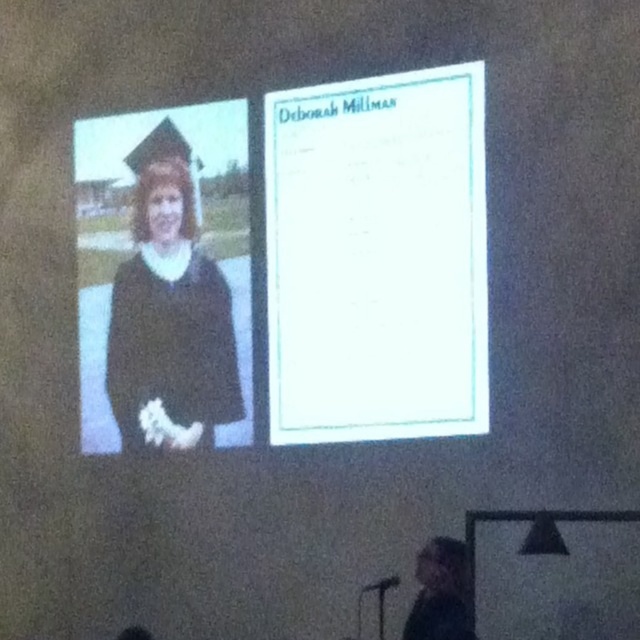
You are a presenter standing in front of the screen. You notice a point at coordinates (x=376, y=257). What object is located at that position?

The point at coordinates (x=376, y=257) corresponds to the white paper at upper center.

You are preparing to present a slide and notice the white paper at upper center and the matte black gown at left on your slide. Which object is placed higher on the slide?

The white paper at upper center is positioned over the matte black gown at left, meaning it is placed higher on the slide.